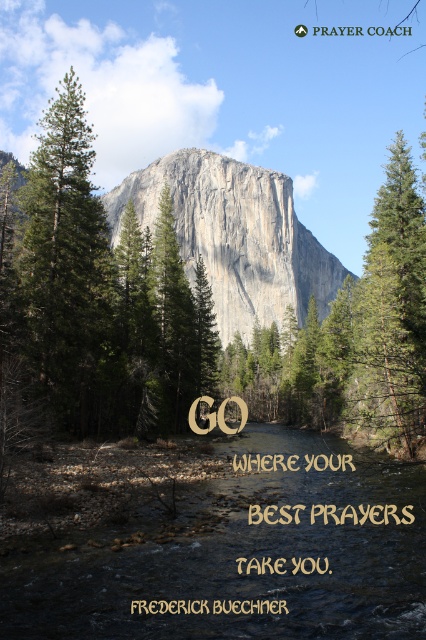
You are standing at the riverbank and see the clear water at center and the gray rock mountain at center. Which object is positioned to the left from your perspective?

The clear water at center is to the left of the gray rock mountain at center.